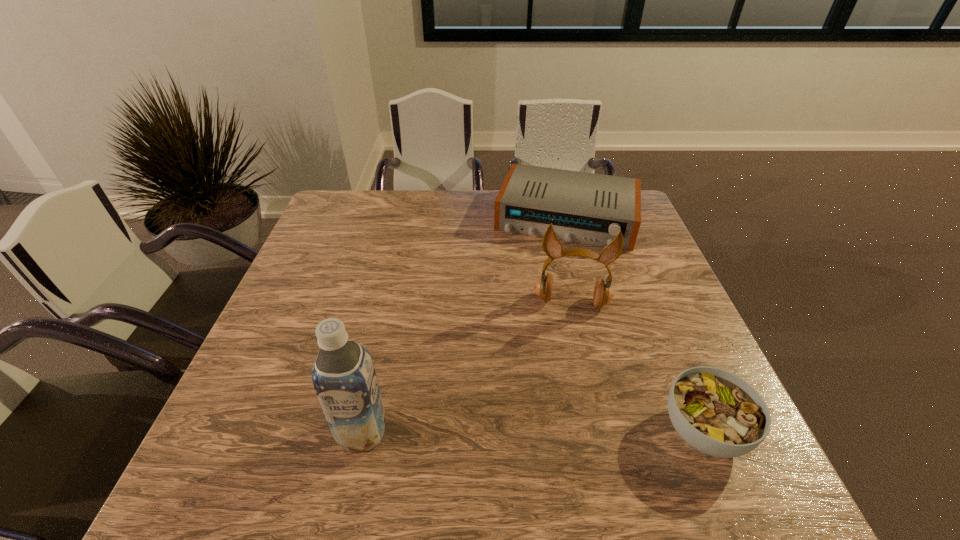
This screenshot has width=960, height=540. In the image, there is a desktop. In order to click on vacant region at the far edge in this screenshot , I will do `click(378, 210)`.

Locate an element on the screen. free location at the near edge of the desktop is located at coordinates (512, 409).

The image size is (960, 540). Find the location of `vacant space at the left edge of the desktop`. vacant space at the left edge of the desktop is located at coordinates (366, 232).

Find the location of `vacant space at the right edge of the desktop`. vacant space at the right edge of the desktop is located at coordinates (668, 281).

Image resolution: width=960 pixels, height=540 pixels. In the image, there is a desktop. What are the coordinates of `free space at the near left corner` in the screenshot? It's located at (225, 436).

Locate an element on the screen. The width and height of the screenshot is (960, 540). free space between the radio receiver and the third nearest object is located at coordinates point(569,260).

At what (x,y) coordinates should I click in order to perform the action: click on free space between the second tallest object and the tallest object. Please return your answer as a coordinate pair (x, y). Looking at the image, I should click on (467, 367).

I want to click on vacant space in between the radio receiver and the soya milk, so click(x=465, y=325).

Identify the location of vacant region between the leftmost object and the earphone. The image size is (960, 540). (467, 367).

Locate an element on the screen. Image resolution: width=960 pixels, height=540 pixels. vacant point located between the soup bowl and the third nearest object is located at coordinates (637, 367).